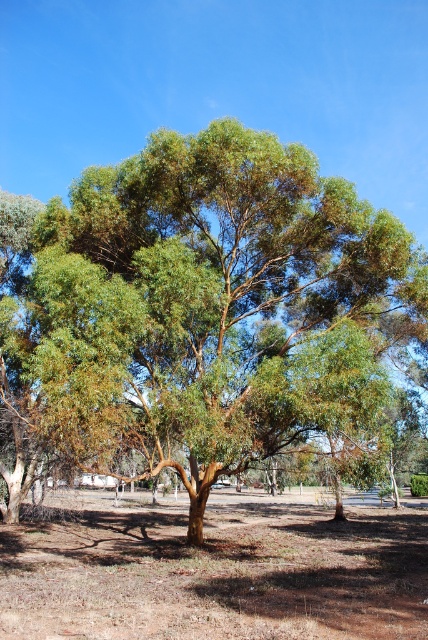
Does green rough bark tree at center have a greater height compared to brown dry soil at center?

Yes.

Is the position of green rough bark tree at center less distant than that of brown dry soil at center?

No, green rough bark tree at center is further to the viewer.

Locate an element on the screen. The height and width of the screenshot is (640, 428). green rough bark tree at center is located at coordinates (204, 314).